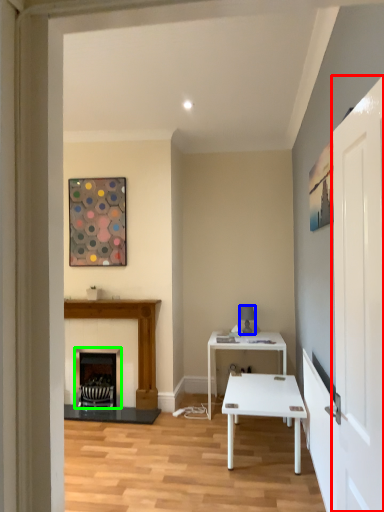
Question: Considering the real-world distances, which object is closest to glass door (highlighted by a red box)? lamp (highlighted by a blue box) or fireplace (highlighted by a green box).

Choices:
 (A) lamp
 (B) fireplace

Answer: (A)